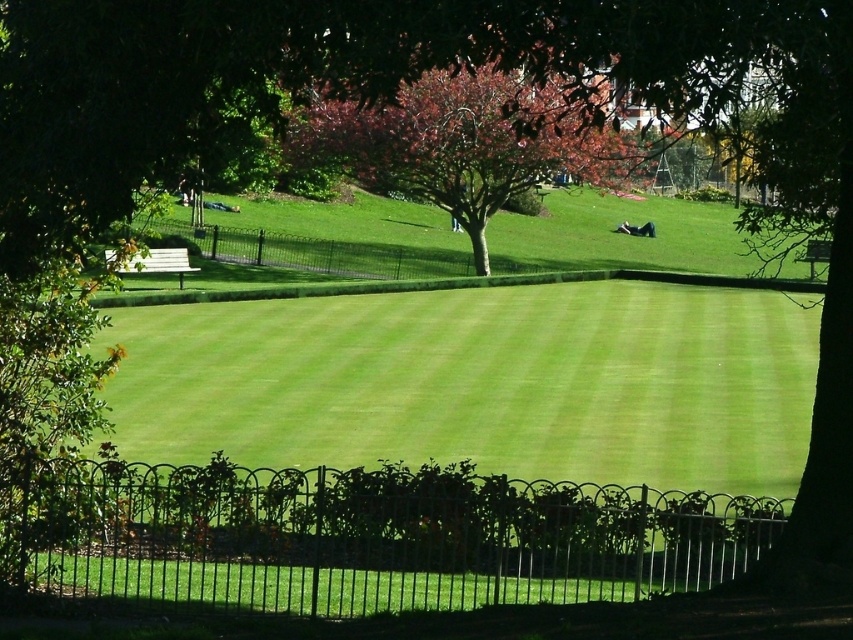
Does smooth pinkish-red tree at center have a larger size compared to wooden park bench at lower right?

Yes.

In the scene shown: Who is lower down, smooth pinkish-red tree at center or wooden park bench at lower right?

Positioned lower is wooden park bench at lower right.

Which is behind, point (467, 99) or point (811, 275)?

The point (811, 275) is more distant.

Locate an element on the screen. This screenshot has width=853, height=640. smooth pinkish-red tree at center is located at coordinates pyautogui.click(x=465, y=140).

Is white wooden bench at left above black matte person at center?

No, white wooden bench at left is not above black matte person at center.

Can you confirm if white wooden bench at left is taller than black matte person at center?

Correct, white wooden bench at left is much taller as black matte person at center.

I want to click on white wooden bench at left, so click(160, 262).

Does green smooth lawn at center have a greater width compared to black matte person at center?

Indeed, green smooth lawn at center has a greater width compared to black matte person at center.

Between point (525, 305) and point (625, 234), which one is positioned behind?

Point (625, 234)

Describe the element at coordinates (480, 381) in the screenshot. I see `green smooth lawn at center` at that location.

Image resolution: width=853 pixels, height=640 pixels. I want to click on green smooth lawn at center, so click(480, 381).